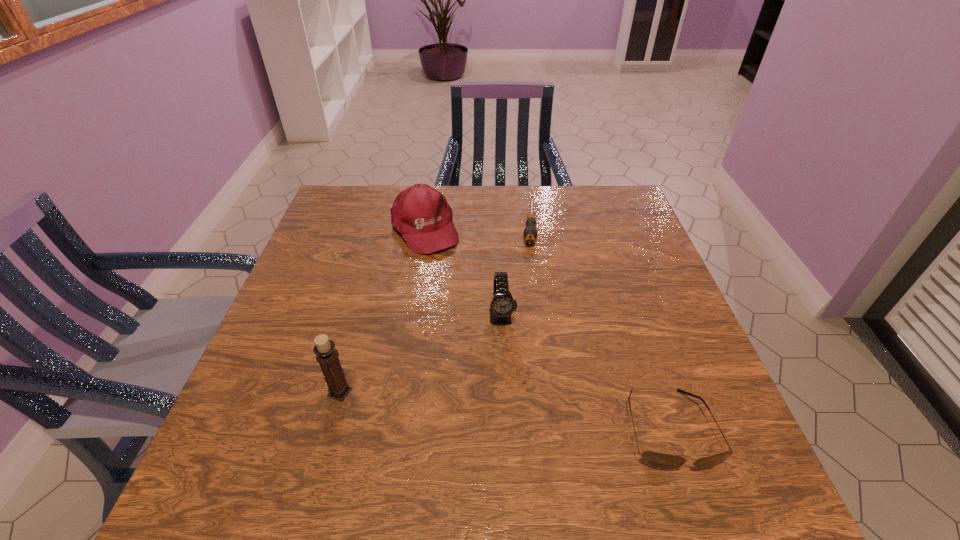
You are a GUI agent. You are given a task and a screenshot of the screen. Output one action in this format:
    pyautogui.click(x=<x>, y=<y>)
    Task: Click on the empty location between the baseball cap and the fourth tallest object
    The image size is (960, 540).
    Given the screenshot: What is the action you would take?
    pyautogui.click(x=545, y=329)

The image size is (960, 540). In order to click on free space that is in between the watch and the tallest object in this screenshot , I will do `click(421, 354)`.

Locate an element on the screen. The height and width of the screenshot is (540, 960). vacant area that lies between the tallest object and the baseball cap is located at coordinates (382, 311).

Identify the location of free spot between the third object from right to left and the candle holder. (421, 354).

Where is `unoccupied area between the screwdriver and the second shortest object`? Image resolution: width=960 pixels, height=540 pixels. unoccupied area between the screwdriver and the second shortest object is located at coordinates point(598,326).

Where is `free space between the third nearest object and the baseball cap`? This screenshot has width=960, height=540. free space between the third nearest object and the baseball cap is located at coordinates (463, 273).

The height and width of the screenshot is (540, 960). Find the location of `vacant area that lies between the second object from right to left and the third farthest object`. vacant area that lies between the second object from right to left and the third farthest object is located at coordinates (516, 270).

In order to click on empty space that is in between the watch and the baseball cap in this screenshot , I will do `click(463, 273)`.

Find the location of a particular element. This screenshot has width=960, height=540. free space between the shortest object and the watch is located at coordinates (516, 270).

This screenshot has width=960, height=540. I want to click on unoccupied position between the screwdriver and the candle holder, so click(x=434, y=308).